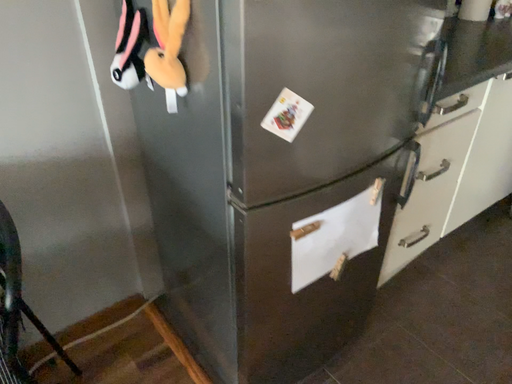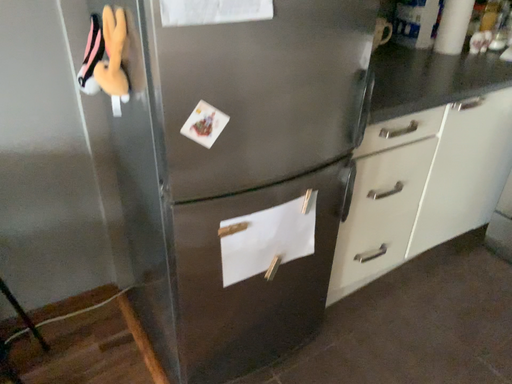
Question: Which way did the camera rotate in the video?

Choices:
 (A) rotated left
 (B) rotated right

Answer: (A)